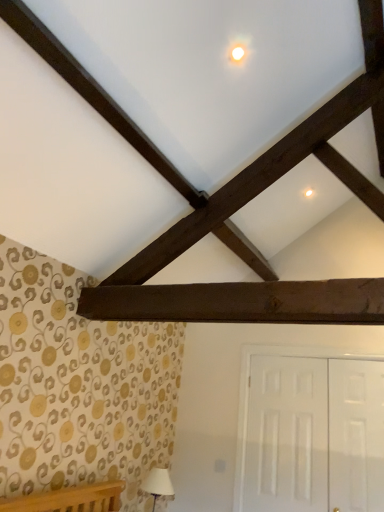
Question: From the image's perspective, would you say white glossy door at right, the 1th door in the right-to-left sequence, is positioned over white glossy door at lower right, which appears as the second door when viewed from the right?

Choices:
 (A) no
 (B) yes

Answer: (B)

Question: Could you tell me if white glossy door at right, the 1th door in the right-to-left sequence, is facing white glossy door at lower right, which appears as the second door when viewed from the right?

Choices:
 (A) no
 (B) yes

Answer: (B)

Question: From a real-world perspective, is white glossy door at right, the 1th door in the right-to-left sequence, physically above white glossy door at lower right, which appears as the second door when viewed from the right?

Choices:
 (A) no
 (B) yes

Answer: (B)

Question: Is white glossy door at right, the 1th door in the right-to-left sequence, surrounding white glossy door at lower right, which appears as the second door when viewed from the right?

Choices:
 (A) yes
 (B) no

Answer: (B)

Question: Considering the relative positions of white glossy door at right, the second door when ordered from left to right, and white glossy door at lower right, the 1th door when ordered from left to right, in the image provided, is white glossy door at right, the second door when ordered from left to right, to the right of white glossy door at lower right, the 1th door when ordered from left to right, from the viewer's perspective?

Choices:
 (A) no
 (B) yes

Answer: (B)

Question: From the image's perspective, relative to dark brown wood plank at center, is white glossy door at right, the 1th door in the right-to-left sequence, above or below?

Choices:
 (A) below
 (B) above

Answer: (A)

Question: Visually, is white glossy door at right, the second door when ordered from left to right, positioned to the left or to the right of dark brown wood plank at center?

Choices:
 (A) right
 (B) left

Answer: (A)

Question: From a real-world perspective, is white glossy door at right, the second door when ordered from left to right, above or below dark brown wood plank at center?

Choices:
 (A) below
 (B) above

Answer: (A)

Question: Considering their positions, is white glossy door at right, the second door when ordered from left to right, located in front of or behind dark brown wood plank at center?

Choices:
 (A) behind
 (B) front

Answer: (A)

Question: Considering the positions of point (167, 482) and point (370, 500), is point (167, 482) closer or farther from the camera than point (370, 500)?

Choices:
 (A) closer
 (B) farther

Answer: (B)

Question: Is white fabric lampshade at lower left wider or thinner than white glossy door at right, the 1th door in the right-to-left sequence?

Choices:
 (A) thin
 (B) wide

Answer: (B)

Question: Is white fabric lampshade at lower left situated inside white glossy door at right, the 1th door in the right-to-left sequence, or outside?

Choices:
 (A) outside
 (B) inside

Answer: (A)

Question: Visually, is white fabric lampshade at lower left positioned to the left or to the right of white glossy door at right, the 1th door in the right-to-left sequence?

Choices:
 (A) right
 (B) left

Answer: (B)

Question: From a real-world perspective, is white glossy door at lower right, the 1th door when ordered from left to right, positioned above or below white fabric lampshade at lower left?

Choices:
 (A) above
 (B) below

Answer: (A)

Question: Considering the positions of white glossy door at lower right, which appears as the second door when viewed from the right, and white fabric lampshade at lower left in the image, is white glossy door at lower right, which appears as the second door when viewed from the right, wider or thinner than white fabric lampshade at lower left?

Choices:
 (A) thin
 (B) wide

Answer: (A)